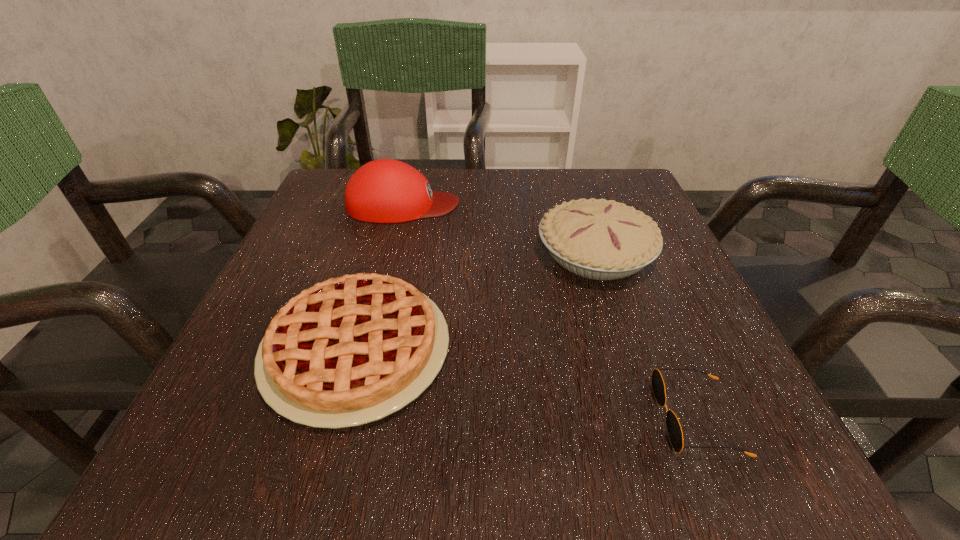
In the image, there is a desktop. Where is `vacant space at the near right corner`? The height and width of the screenshot is (540, 960). vacant space at the near right corner is located at coordinates (698, 422).

Locate an element on the screen. This screenshot has width=960, height=540. free area in between the right pie and the baseball cap is located at coordinates pos(499,229).

Where is `vacant space that is in between the tallest object and the sunglasses`? The width and height of the screenshot is (960, 540). vacant space that is in between the tallest object and the sunglasses is located at coordinates (550, 311).

The image size is (960, 540). What are the coordinates of `empty space that is in between the second tallest object and the tallest object` in the screenshot? It's located at (499, 229).

Where is `empty space between the third shortest object and the shortest object`? The image size is (960, 540). empty space between the third shortest object and the shortest object is located at coordinates (646, 335).

At what (x,y) coordinates should I click in order to perform the action: click on vacant area that lies between the shorter pie and the second tallest object. Please return your answer as a coordinate pair (x, y). The image size is (960, 540). Looking at the image, I should click on tap(476, 301).

Where is `free space between the shortest object and the baseball cap`? Image resolution: width=960 pixels, height=540 pixels. free space between the shortest object and the baseball cap is located at coordinates (550, 311).

Locate an element on the screen. The height and width of the screenshot is (540, 960). unoccupied position between the left pie and the sunglasses is located at coordinates (527, 383).

I want to click on object that is the third closest to the right pie, so click(x=674, y=429).

Locate an element on the screen. The width and height of the screenshot is (960, 540). object that is the second closest one to the shorter pie is located at coordinates (385, 190).